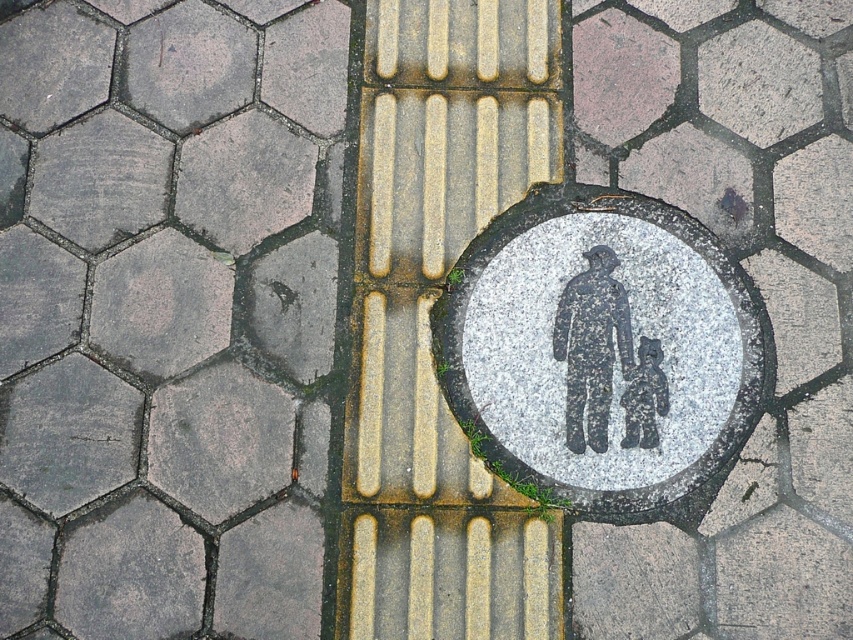
You are a delivery robot with a 4.0 inch wide base. You need to move from the granite circle at center to the dark gray stone figure at center. Is there enough space for you to navigate between them?

The distance between the granite circle at center and the dark gray stone figure at center is 4.18 inches. Since your base is 4.0 inches wide, there is sufficient space for you to navigate between them as the distance is slightly larger than your width.

You are a delivery robot with a 1.2 meter wide base. You need to navigate through the pedestrian crossing shown in the image. The path requires moving between the black textured figure at center and the dark gray stone figure at center. Can your base fit through the space between them?

The black textured figure at center is wider than the dark gray stone figure at center. Since the robot has a 1.2 meter wide base, it depends on the actual width of the narrower figure. However, without specific measurements, we cannot confirm if the space is sufficient. Please check the exact dimensions.

You are standing at the point with coordinates point (590, 326) and want to walk to the point with coordinates point (639, 403). In which direction should you move relative to the tactile paving strip?

Since point (590, 326) is behind point (639, 403), you should move forward towards the tactile paving strip to reach your destination.